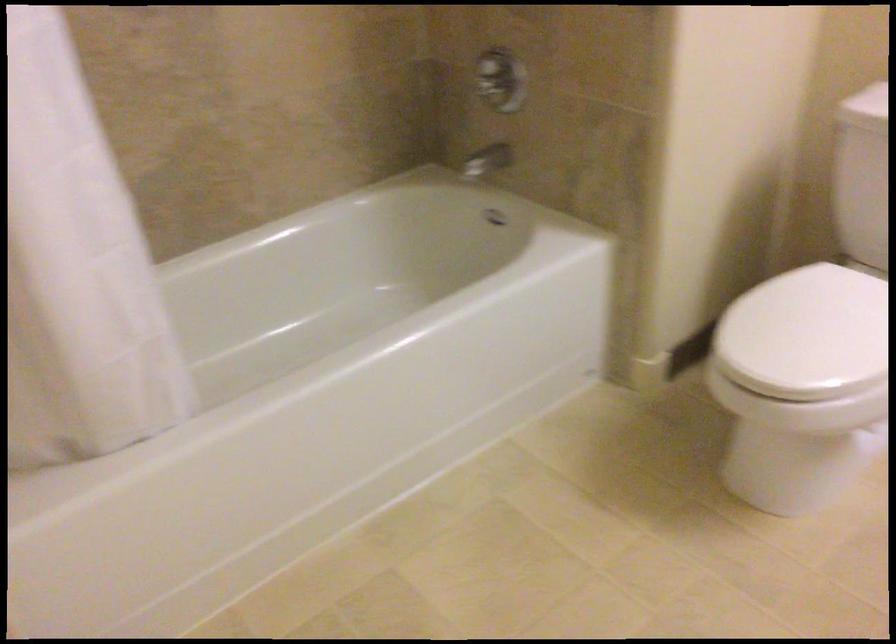
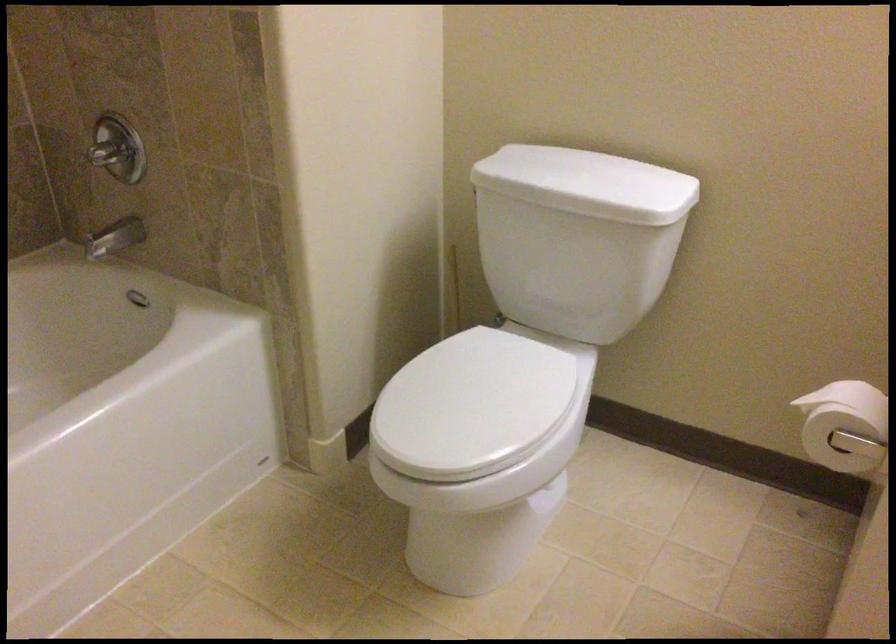
Question: The images are taken continuously from a first-person perspective. In which direction is your viewpoint rotating?

Choices:
 (A) Left
 (B) Right
 (C) Up
 (D) Down

Answer: (B)